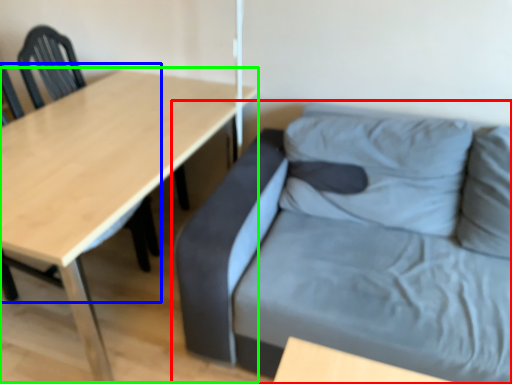
Question: Based on their relative distances, which object is farther from studio couch (highlighted by a red box)? Choose from chair (highlighted by a blue box) and table (highlighted by a green box).

Choices:
 (A) chair
 (B) table

Answer: (A)